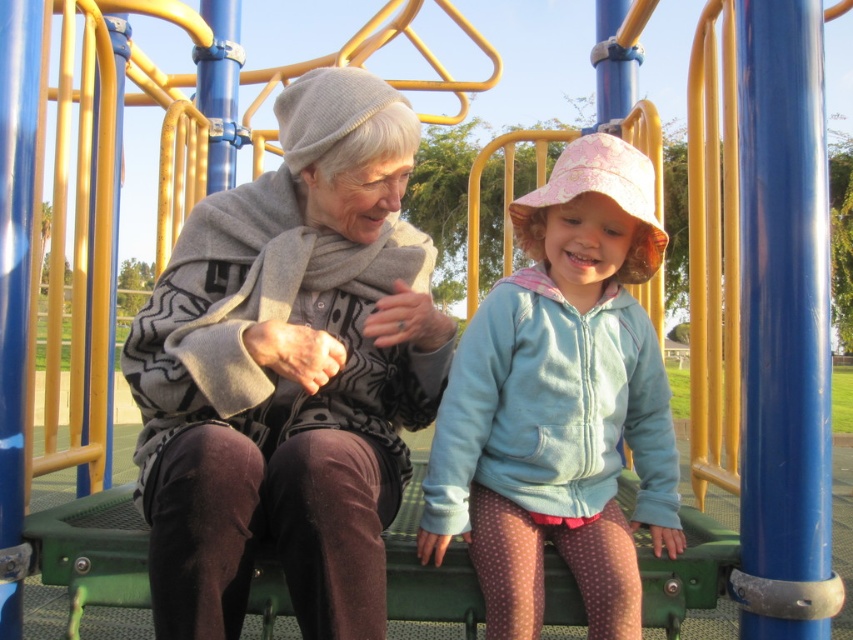
You are a photographer trying to capture a closeup of the knitted gray hat at upper left and the light blue fleece jacket at center. Which object should you focus on first if you want to ensure both are in focus without moving the camera?

The knitted gray hat at upper left is located above the light blue fleece jacket at center. Since the hat is higher up, you should focus on the knitted gray hat at upper left first to ensure both are in focus without moving the camera.

You are a photographer trying to capture a photo of the knitted gray hat at upper left and the light blue fleece jacket at center. Which object should you focus on first if you want to ensure both are in sharp focus?

The knitted gray hat at upper left is much taller than the light blue fleece jacket at center, so focusing on the knitted gray hat at upper left first would ensure both are in sharp focus.